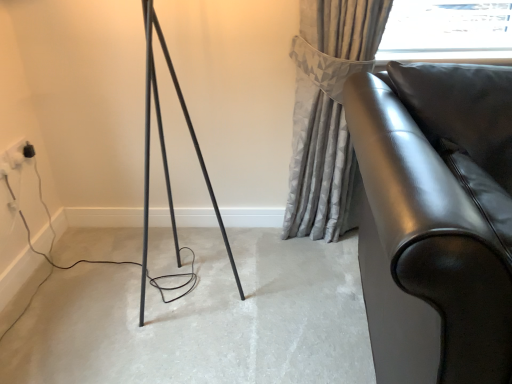
Question: Considering the relative sizes of glossy leather sofa at right and matte black floor at center in the image provided, is glossy leather sofa at right thinner than matte black floor at center?

Choices:
 (A) yes
 (B) no

Answer: (B)

Question: From a real-world perspective, is glossy leather sofa at right physically above matte black floor at center?

Choices:
 (A) no
 (B) yes

Answer: (B)

Question: Is glossy leather sofa at right next to matte black floor at center and touching it?

Choices:
 (A) yes
 (B) no

Answer: (B)

Question: Is glossy leather sofa at right not within matte black floor at center?

Choices:
 (A) yes
 (B) no

Answer: (A)

Question: Considering the relative positions of glossy leather sofa at right and matte black floor at center in the image provided, is glossy leather sofa at right to the right of matte black floor at center from the viewer's perspective?

Choices:
 (A) no
 (B) yes

Answer: (B)

Question: Choose the correct answer: Is matte black floor at center inside black plastic outlet at lower left or outside it?

Choices:
 (A) inside
 (B) outside

Answer: (B)

Question: Considering the positions of point (16, 377) and point (8, 150), is point (16, 377) closer or farther from the camera than point (8, 150)?

Choices:
 (A) closer
 (B) farther

Answer: (A)

Question: From the image's perspective, is matte black floor at center above or below black plastic outlet at lower left?

Choices:
 (A) above
 (B) below

Answer: (B)

Question: Is matte black floor at center taller or shorter than black plastic outlet at lower left?

Choices:
 (A) tall
 (B) short

Answer: (B)

Question: From a real-world perspective, is gray textured curtain at upper right physically located above or below black plastic outlet at lower left?

Choices:
 (A) below
 (B) above

Answer: (B)

Question: Visually, is gray textured curtain at upper right positioned to the left or to the right of black plastic outlet at lower left?

Choices:
 (A) right
 (B) left

Answer: (A)

Question: Looking at the image, does gray textured curtain at upper right seem bigger or smaller compared to black plastic outlet at lower left?

Choices:
 (A) big
 (B) small

Answer: (A)

Question: In the image, is gray textured curtain at upper right positioned in front of or behind black plastic outlet at lower left?

Choices:
 (A) front
 (B) behind

Answer: (A)

Question: Is point (15, 163) positioned closer to the camera than point (414, 273)?

Choices:
 (A) closer
 (B) farther

Answer: (B)

Question: Looking at their shapes, would you say black plastic outlet at lower left is wider or thinner than glossy leather sofa at right?

Choices:
 (A) wide
 (B) thin

Answer: (B)